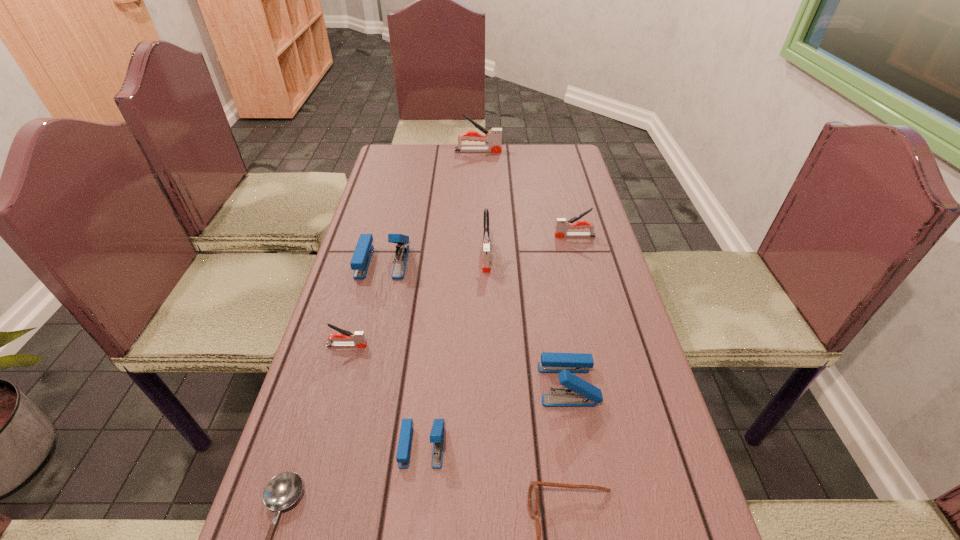
At what (x,y) coordinates should I click in order to perform the action: click on the tallest object. Please return your answer as a coordinate pair (x, y). This screenshot has width=960, height=540. Looking at the image, I should click on (494, 136).

The height and width of the screenshot is (540, 960). Identify the location of the farthest object. (494, 136).

Locate an element on the screen. This screenshot has width=960, height=540. the third farthest gray stapler is located at coordinates (486, 264).

The height and width of the screenshot is (540, 960). What are the coordinates of `the farthest blue stapler` in the screenshot? It's located at (361, 257).

Find the location of a particular element. The height and width of the screenshot is (540, 960). the biggest blue stapler is located at coordinates (361, 257).

This screenshot has height=540, width=960. What are the coordinates of `the sixth nearest stapler` in the screenshot? It's located at (562, 225).

Where is `the third biggest gray stapler`? The width and height of the screenshot is (960, 540). the third biggest gray stapler is located at coordinates (562, 225).

Find the location of a particular element. Image resolution: width=960 pixels, height=540 pixels. the second nearest blue stapler is located at coordinates (579, 393).

Where is `the sixth farthest object`? This screenshot has height=540, width=960. the sixth farthest object is located at coordinates (579, 393).

Where is `the nearest gray stapler`? The image size is (960, 540). the nearest gray stapler is located at coordinates (358, 337).